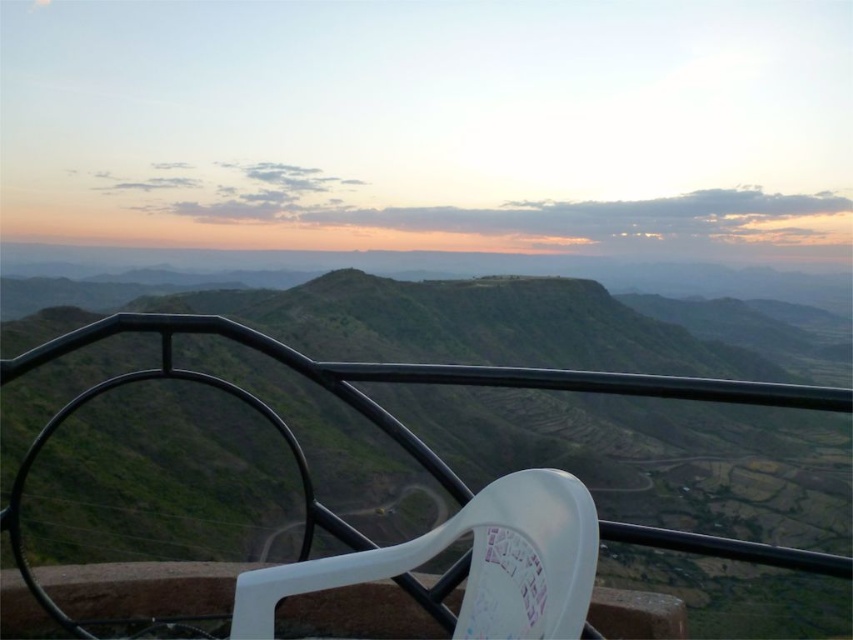
Consider the image. You are standing on a viewing platform and see the green matte hill at center and the white plastic chair at center. Which object is located to the right side?

The white plastic chair at center is located to the right of the green matte hill at center.

You are standing on the viewing platform and want to take a photo of the green matte hill at center. According to the coordinates provided, where should you aim your camera to capture the hill in the frame?

The green matte hill at center is located at point (669, 486), so you should aim your camera towards those coordinates to capture it in the frame.

You are standing on a balcony with a view of the landscape. You see a green matte hill at center and a white plastic chair at center. Which object takes up more space in the scene?

The green matte hill at center is bigger than the white plastic chair at center, so it takes up more space in the scene.